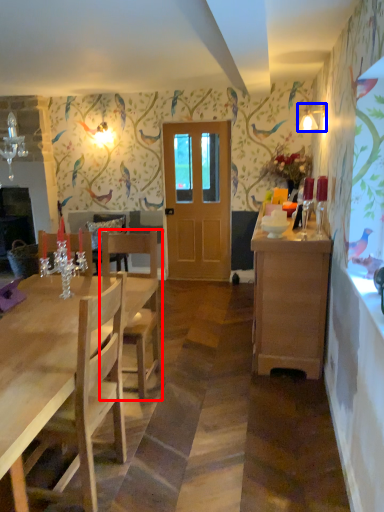
Question: Which object is closer to the camera taking this photo, chair (highlighted by a red box) or lamp (highlighted by a blue box)?

Choices:
 (A) chair
 (B) lamp

Answer: (A)